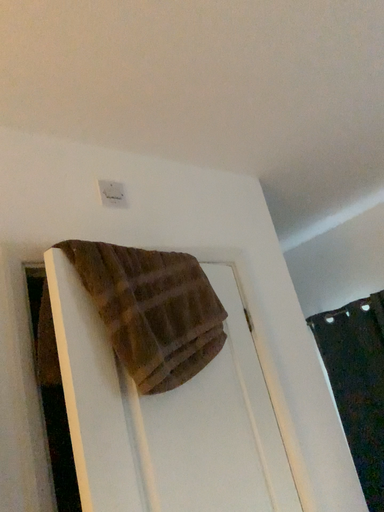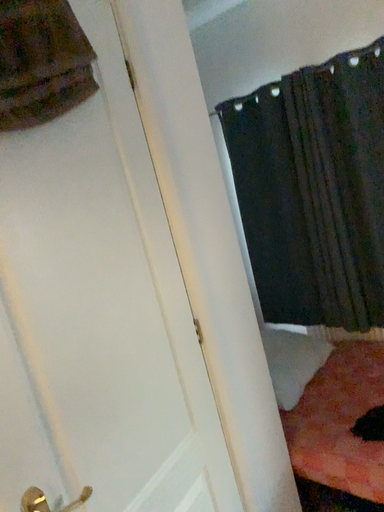
Question: Which way did the camera rotate in the video?

Choices:
 (A) rotated left
 (B) rotated right

Answer: (B)